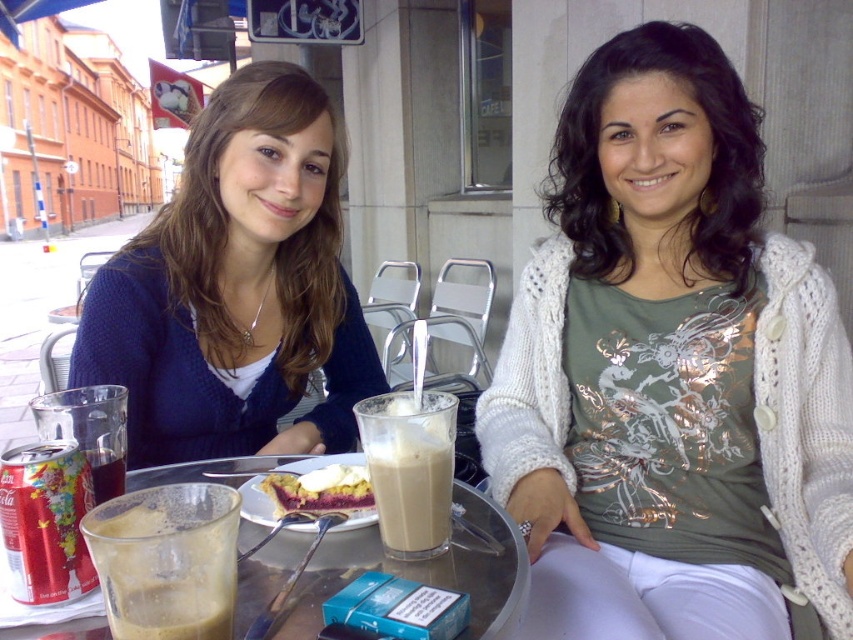
Looking at this image, you are a barista at the outdoor cafe. You need to place a new order for a customer. The order includes a hot chocolate and a slice of cake. The customer specifies that the hot chocolate should be placed on the left side of the transparent glass at center. Where should you place the matte blue sweater at center while arranging the items?

The matte blue sweater at center is thinner than the transparent glass at center, so you should place the matte blue sweater at center to the left of the transparent glass at center to accommodate the hot chocolate on its left side.

You are a barista at the outdoor cafe. You need to place a new order for a customer who ordered a hot chocolate. The customer is sitting at the table where the matte blue sweater at center and the translucent glass cup at lower left are present. Which object should you place the hot chocolate in front of, considering the size of the existing items?

The hot chocolate should be placed in front of the translucent glass cup at lower left because the matte blue sweater at center is larger in size and might take up more space, leaving less room for the new drink.

You are a photographer standing at the center of the image. You need to place a prop at the exact center of the image. Is the matte blue sweater at center located exactly at the center of the image? Please explain your reasoning.

The 2D location of matte blue sweater at center is at point [236,288], which is not the exact center of the image. The exact center would be at coordinates [426,320]. Therefore, the sweater is slightly to the left and lower than the true center.